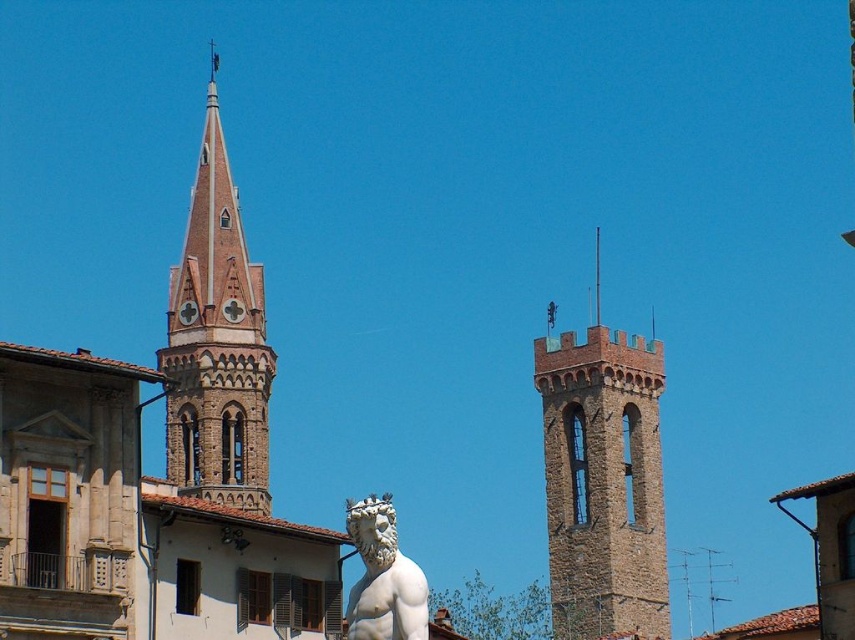
Is point (228, 440) positioned after point (354, 589)?

Yes, point (228, 440) is farther from viewer.

Who is more forward, (210,170) or (357,534)?

Point (357,534) is more forward.

This screenshot has height=640, width=855. Find the location of `brown stone spire at upper left`. brown stone spire at upper left is located at coordinates (216, 342).

Is brown stone tower at upper right below brown stone spire at upper left?

Yes.

Does point (575, 572) come behind point (205, 452)?

That is True.

The width and height of the screenshot is (855, 640). I want to click on brown stone tower at upper right, so click(x=603, y=481).

Is point (624, 483) farther from viewer compared to point (357, 544)?

Yes, it is.

The image size is (855, 640). Identify the location of brown stone tower at upper right. (603, 481).